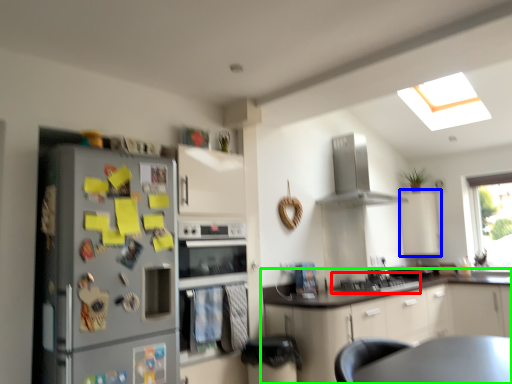
Question: Which object is positioned closest to gas stove (highlighted by a red box)? Select from cabinetry (highlighted by a blue box) and cabinetry (highlighted by a green box).

Choices:
 (A) cabinetry
 (B) cabinetry

Answer: (B)